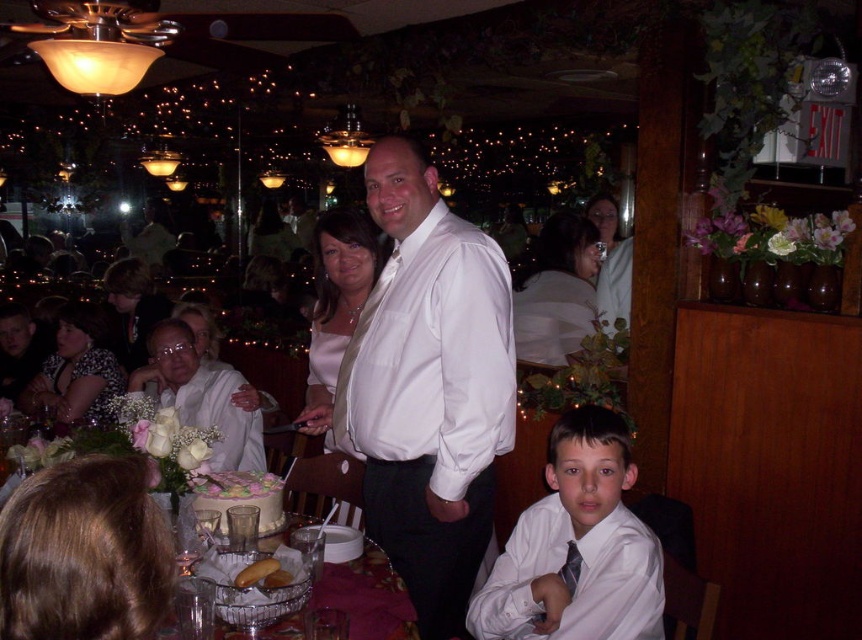
Question: Can you confirm if matte white blouse at upper center is thinner than white frosted cake at center?

Choices:
 (A) yes
 (B) no

Answer: (B)

Question: Can you confirm if white frosted cake at center is positioned to the right of golden bread at table center?

Choices:
 (A) yes
 (B) no

Answer: (B)

Question: From the image, what is the correct spatial relationship of matte white blouse at upper center in relation to matte white blouse at upper right?

Choices:
 (A) below
 (B) above

Answer: (A)

Question: Which point is farther to the camera?

Choices:
 (A) (579, 241)
 (B) (264, 497)
 (C) (388, 273)
 (D) (92, 556)

Answer: (A)

Question: Among these objects, which one is nearest to the camera?

Choices:
 (A) floral-patterned blouse at left
 (B) golden bread at table center
 (C) satin white blouse at center

Answer: (B)

Question: Which of the following is the farthest from the observer?

Choices:
 (A) white satin shirt at center
 (B) floral-patterned blouse at left

Answer: (B)